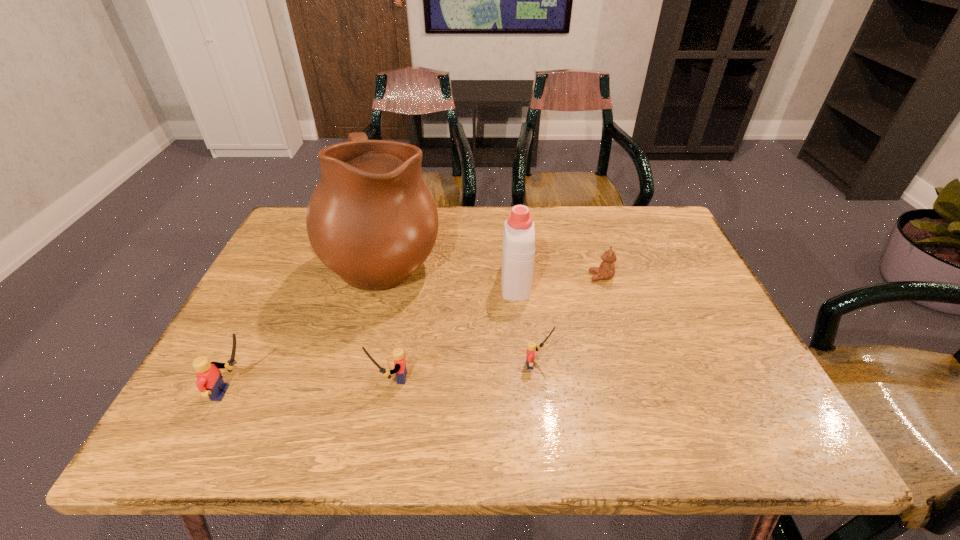
Identify the location of vacant spot to place a Lego on the right. (678, 352).